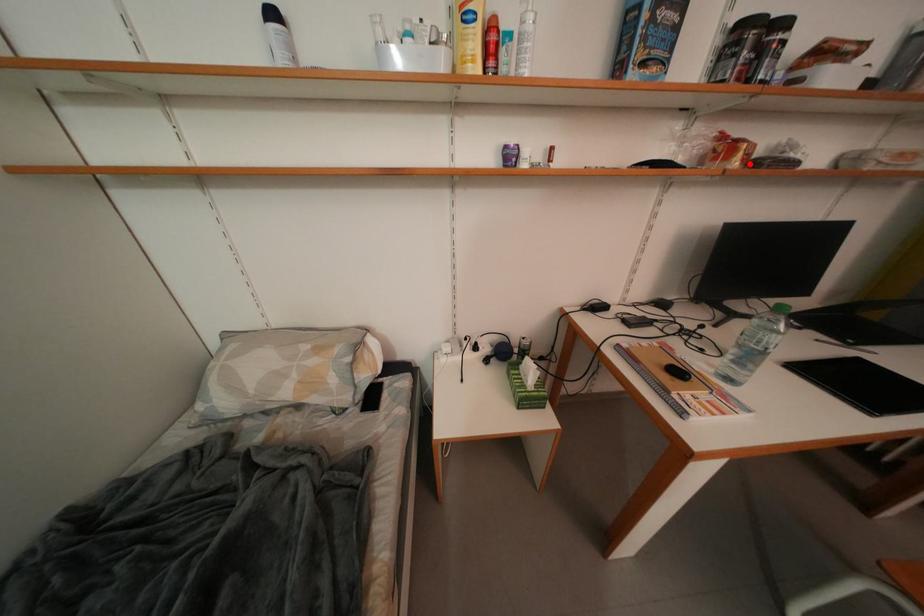
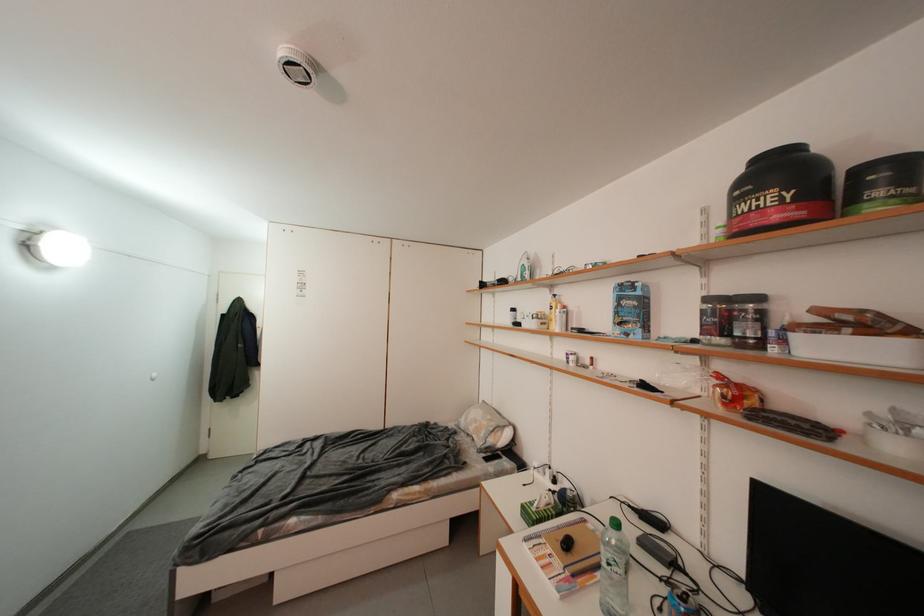
Question: I am providing you with two images of the same scene from different viewpoints. A red point is marked on the first image. Can you still see the location of the red point in image 2?

Choices:
 (A) Yes
 (B) No

Answer: (A)